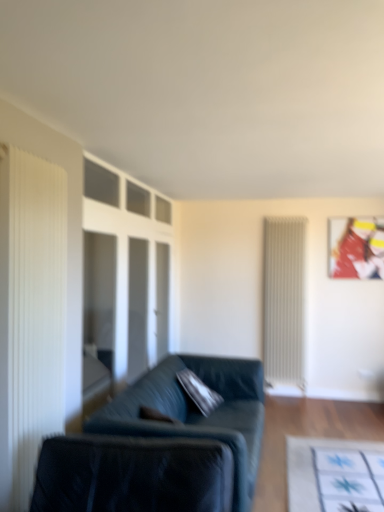
What do you see at coordinates (30, 316) in the screenshot?
I see `white pleated curtain at left` at bounding box center [30, 316].

Describe the element at coordinates (284, 301) in the screenshot. I see `white ribbed radiator at right` at that location.

What are the coordinates of `white ribbed radiator at right` in the screenshot? It's located at tap(284, 301).

What is the approximate width of velvet dark green couch at center?

It is 38.23 inches.

You are a GUI agent. You are given a task and a screenshot of the screen. Output one action in this format:
    pyautogui.click(x=<x>, y=<y>)
    Task: Click on the velvet black swivel chair at lower left
    This screenshot has height=512, width=384.
    Given the screenshot: What is the action you would take?
    pyautogui.click(x=132, y=475)

Considering the positions of objects transparent glass door at center and metallic glossy picture frame at upper right in the image provided, who is more to the left, transparent glass door at center or metallic glossy picture frame at upper right?

Positioned to the left is transparent glass door at center.

Is transparent glass door at center placed right next to metallic glossy picture frame at upper right?

transparent glass door at center is not next to metallic glossy picture frame at upper right, and they're not touching.

Which of these two, transparent glass door at center or metallic glossy picture frame at upper right, stands shorter?

With less height is metallic glossy picture frame at upper right.

From the image's perspective, is transparent glass door at center on top of metallic glossy picture frame at upper right?

No, from the image's perspective, transparent glass door at center is not above metallic glossy picture frame at upper right.

Is white pleated curtain at left thinner than white ribbed radiator at right?

Yes, white pleated curtain at left is thinner than white ribbed radiator at right.

Between white pleated curtain at left and white ribbed radiator at right, which one has less height?

white pleated curtain at left is shorter.

From a real-world perspective, is white pleated curtain at left under white ribbed radiator at right?

Incorrect, from a real-world perspective, white pleated curtain at left is higher than white ribbed radiator at right.

In the image, is white pleated curtain at left positioned in front of or behind white ribbed radiator at right?

Answer: Clearly, white pleated curtain at left is in front of white ribbed radiator at right.

Is point (264, 351) farther from viewer compared to point (47, 248)?

Yes, point (264, 351) is behind point (47, 248).

Which object is thinner, white ribbed radiator at right or white pleated curtain at left?

white pleated curtain at left is thinner.

From a real-world perspective, does white ribbed radiator at right sit lower than white pleated curtain at left?

Yes, from a real-world perspective, white ribbed radiator at right is beneath white pleated curtain at left.

From the image's perspective, is white ribbed radiator at right on top of white pleated curtain at left?

No, from the image's perspective, white ribbed radiator at right is not over white pleated curtain at left.

In the image, is white pleated curtain at left positioned in front of or behind metallic glossy picture frame at upper right?

Visually, white pleated curtain at left is located in front of metallic glossy picture frame at upper right.

Is white pleated curtain at left far from metallic glossy picture frame at upper right?

Yes, white pleated curtain at left and metallic glossy picture frame at upper right are quite far apart.

From the image's perspective, would you say white pleated curtain at left is positioned over metallic glossy picture frame at upper right?

No, from the image's perspective, white pleated curtain at left is not on top of metallic glossy picture frame at upper right.

Is transparent glass door at center positioned far away from white pleated curtain at left?

Indeed, transparent glass door at center is not near white pleated curtain at left.

Does transparent glass door at center have a lesser height compared to white pleated curtain at left?

Correct, transparent glass door at center is not as tall as white pleated curtain at left.

From a real-world perspective, is transparent glass door at center below white pleated curtain at left?

Yes.

Are velvet dark green pillow at center and white pleated curtain at left making contact?

They are not placed beside each other.

What's the angular difference between velvet dark green pillow at center and white pleated curtain at left's facing directions?

4.37 degrees separate the facing orientations of velvet dark green pillow at center and white pleated curtain at left.

Looking at this image, from a real-world perspective, is velvet dark green pillow at center positioned above or below white pleated curtain at left?

In terms of real-world spatial position, velvet dark green pillow at center is below white pleated curtain at left.

Is velvet dark green pillow at center oriented towards white pleated curtain at left?

No, velvet dark green pillow at center is not oriented towards white pleated curtain at left.

Considering the sizes of white ribbed radiator at right and velvet dark green couch at center in the image, is white ribbed radiator at right bigger or smaller than velvet dark green couch at center?

Clearly, white ribbed radiator at right is smaller in size than velvet dark green couch at center.

This screenshot has height=512, width=384. I want to click on radiator that appears above the velvet dark green couch at center (from a real-world perspective), so click(284, 301).

Based on the photo, from the image's perspective, between white ribbed radiator at right and velvet dark green couch at center, who is located below?

velvet dark green couch at center, from the image's perspective.

Looking at this image, which object is positioned more to the left, white ribbed radiator at right or velvet dark green couch at center?

velvet dark green couch at center.

Find the location of a particular element. Image resolution: width=384 pixels, height=512 pixels. glass door that is under the metallic glossy picture frame at upper right (from a real-world perspective) is located at coordinates (137, 308).

Find the location of `radiator on the right of white pleated curtain at left`. radiator on the right of white pleated curtain at left is located at coordinates (284, 301).

Considering their positions, is white pleated curtain at left positioned further to transparent glass door at center than velvet dark green couch at center?

white pleated curtain at left is further to transparent glass door at center.

When comparing their distances from transparent glass door at center, does metallic glossy picture frame at upper right or velvet dark green couch at center seem further?

metallic glossy picture frame at upper right lies further to transparent glass door at center than the other object.

Based on their spatial positions, is metallic glossy picture frame at upper right or white pleated curtain at left further from transparent glass door at center?

Among the two, white pleated curtain at left is located further to transparent glass door at center.

When comparing their distances from metallic glossy picture frame at upper right, does velvet dark green couch at center or white ribbed radiator at right seem further?

velvet dark green couch at center is positioned further to the anchor metallic glossy picture frame at upper right.

From the image, which object appears to be nearer to white pleated curtain at left, velvet black swivel chair at lower left or transparent glass door at center?

The object closer to white pleated curtain at left is velvet black swivel chair at lower left.

Which object lies nearer to the anchor point velvet dark green pillow at center, velvet black swivel chair at lower left or white ribbed radiator at right?

velvet black swivel chair at lower left lies closer to velvet dark green pillow at center than the other object.

Based on their spatial positions, is transparent glass door at center or white ribbed radiator at right further from velvet dark green pillow at center?

The object further to velvet dark green pillow at center is white ribbed radiator at right.

Looking at the image, which one is located closer to velvet dark green couch at center, white pleated curtain at left or velvet black swivel chair at lower left?

Based on the image, velvet black swivel chair at lower left appears to be nearer to velvet dark green couch at center.

This screenshot has width=384, height=512. I want to click on pillow between velvet dark green couch at center and white ribbed radiator at right from front to back, so click(x=199, y=392).

Image resolution: width=384 pixels, height=512 pixels. I want to click on pillow positioned between white pleated curtain at left and transparent glass door at center from near to far, so click(x=199, y=392).

The image size is (384, 512). Find the location of `radiator between transparent glass door at center and metallic glossy picture frame at upper right from left to right`. radiator between transparent glass door at center and metallic glossy picture frame at upper right from left to right is located at coordinates (284, 301).

Locate an element on the screen. The image size is (384, 512). studio couch between white pleated curtain at left and metallic glossy picture frame at upper right in the front-back direction is located at coordinates (197, 412).